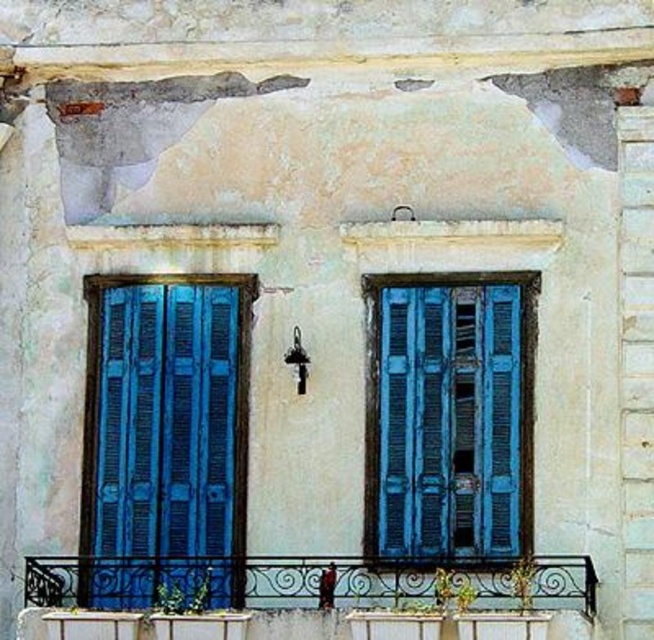
Is blue wooden window at center below wrought iron balcony at lower center?

No, blue wooden window at center is not below wrought iron balcony at lower center.

Who is more forward, (x=451, y=298) or (x=568, y=570)?

Point (x=568, y=570) is more forward.

Who is more forward, (458, 497) or (54, 589)?

Point (458, 497) is more forward.

Where is `blue wooden window at center`? blue wooden window at center is located at coordinates (449, 419).

Does blue wooden shutters at left have a greater height compared to blue wooden window at center?

Yes.

Is blue wooden shutters at left to the right of blue wooden window at center from the viewer's perspective?

In fact, blue wooden shutters at left is to the left of blue wooden window at center.

Between point (124, 474) and point (528, 442), which one is positioned in front?

Point (528, 442) is in front.

Identify the location of blue wooden shutters at left. tap(164, 436).

Who is taller, blue wooden shutters at left or wrought iron balcony at lower center?

Standing taller between the two is blue wooden shutters at left.

Can you confirm if blue wooden shutters at left is positioned to the right of wrought iron balcony at lower center?

Incorrect, blue wooden shutters at left is not on the right side of wrought iron balcony at lower center.

Who is more forward, (82, 506) or (483, 573)?

Point (483, 573) is in front.

The height and width of the screenshot is (640, 654). Identify the location of blue wooden shutters at left. (164, 436).